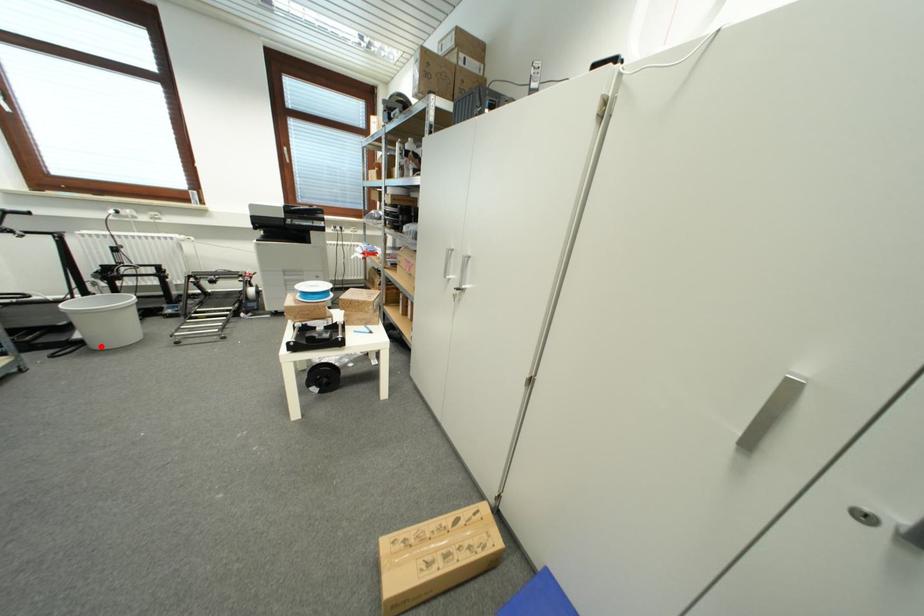
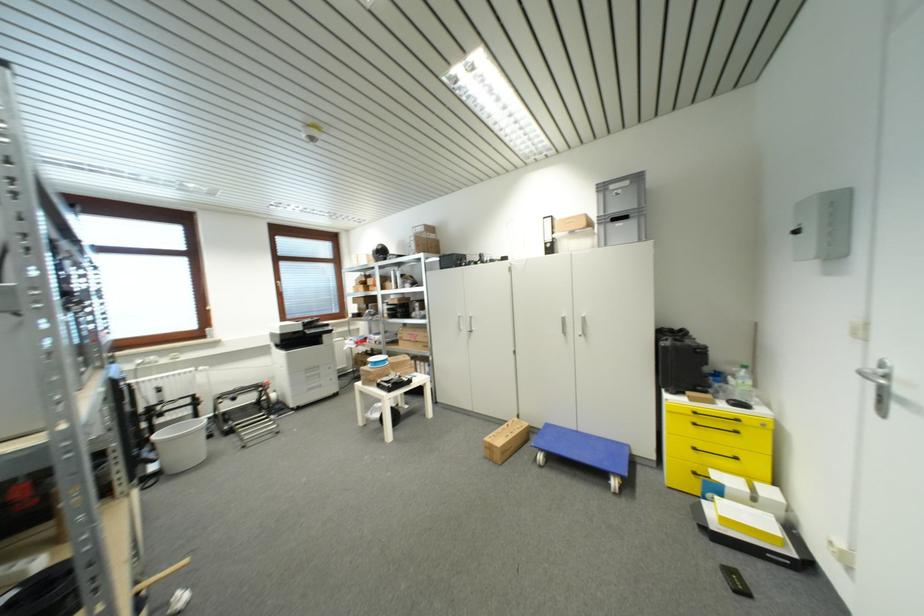
The point at the highlighted location is marked in the first image. Where is the corresponding point in the second image?

(177, 472)